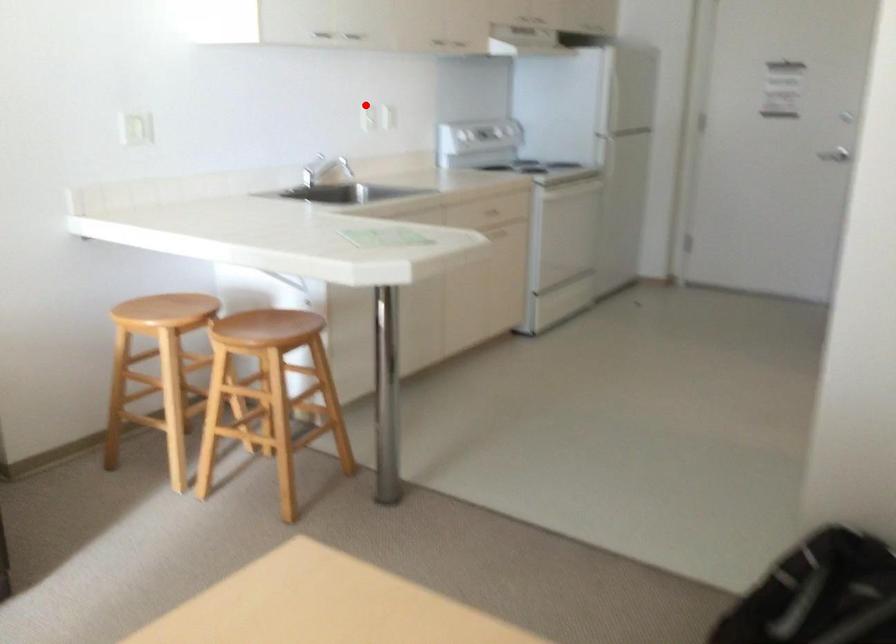
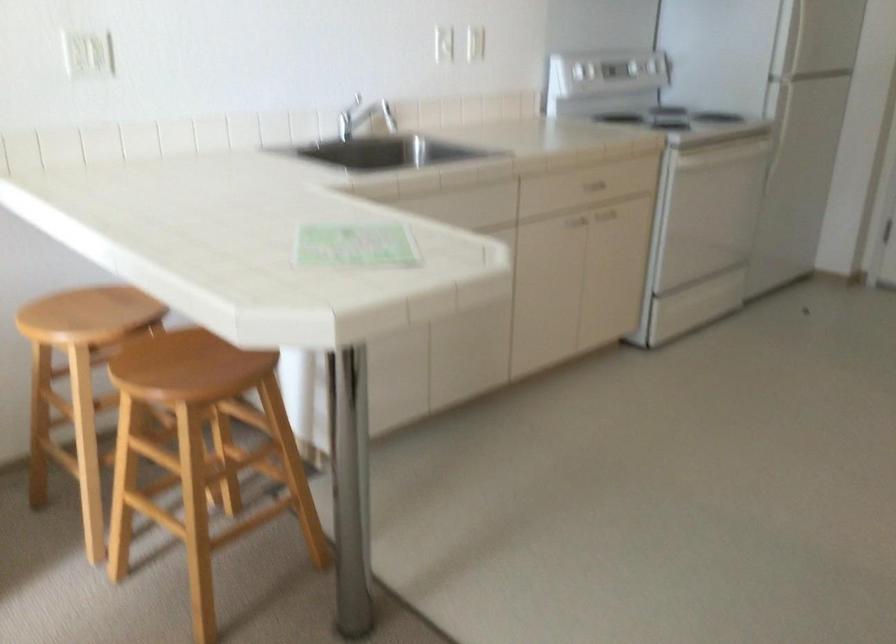
Question: I am providing you with two images of the same scene from different viewpoints. Image1 has a red point marked. In image2, the corresponding 3D location appears at what relative position? Reply with the corresponding letter.

Choices:
 (A) Closer
 (B) Farther

Answer: (A)